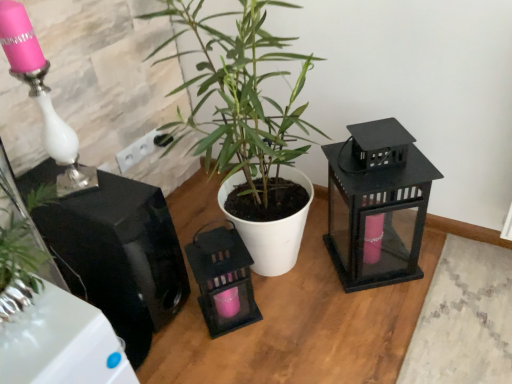
Where is `vacant space positioned to the left of matte black lantern at right, acting as the 2th appliance starting from the left`? vacant space positioned to the left of matte black lantern at right, acting as the 2th appliance starting from the left is located at coordinates (303, 277).